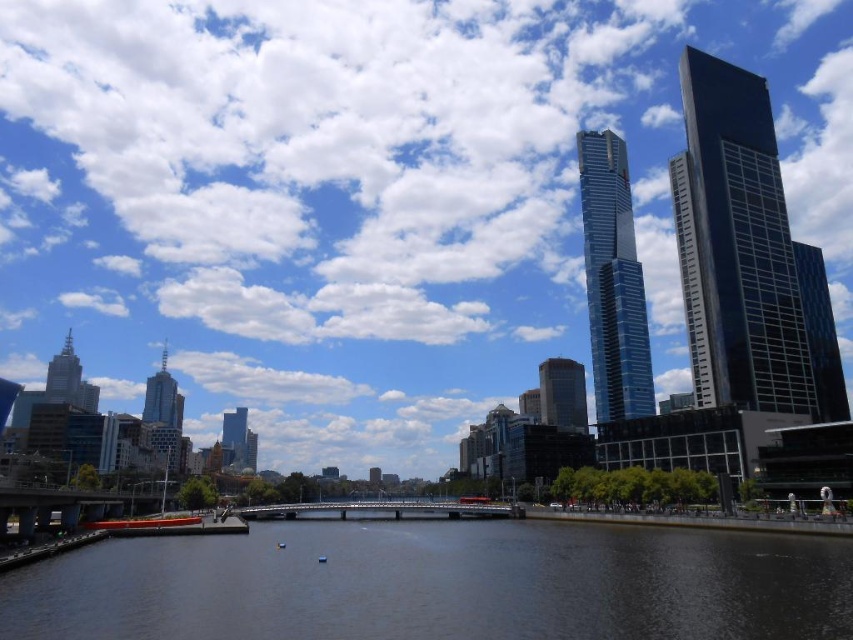
Who is shorter, dark blue water at center or glassy blue skyscraper at center right?

With less height is dark blue water at center.

Is point (368, 541) positioned in front of point (648, 368)?

Yes, point (368, 541) is closer to viewer.

What do you see at coordinates (438, 584) in the screenshot?
I see `dark blue water at center` at bounding box center [438, 584].

You are a GUI agent. You are given a task and a screenshot of the screen. Output one action in this format:
    pyautogui.click(x=<x>, y=<y>)
    Task: Click on the dark blue water at center
    The image size is (853, 640).
    Given the screenshot: What is the action you would take?
    pyautogui.click(x=438, y=584)

Who is more distant from viewer, [155,388] or [53,365]?

The point [155,388] is more distant.

The height and width of the screenshot is (640, 853). Identify the location of shiny metallic skyscraper at left. (161, 397).

Can you confirm if shiny silver spire at left is positioned to the right of glassy blue skyscraper at center?

In fact, shiny silver spire at left is to the left of glassy blue skyscraper at center.

Who is more distant from viewer, [51,397] or [248,461]?

The point [248,461] is behind.

Locate an element on the screen. The image size is (853, 640). shiny silver spire at left is located at coordinates (64, 376).